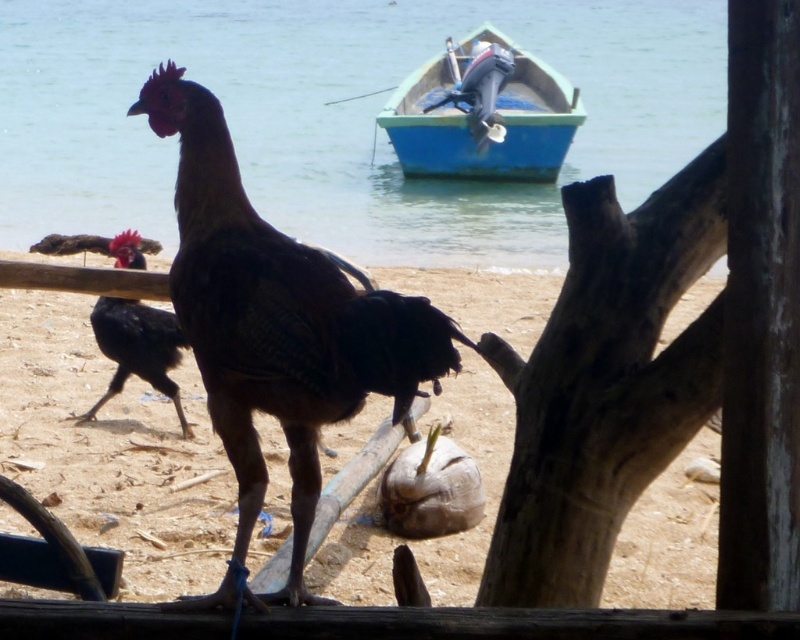
Which is below, blue painted wood boat at upper center or black matte chicken at center?

black matte chicken at center

Does blue painted wood boat at upper center appear on the left side of black matte chicken at center?

No, blue painted wood boat at upper center is not to the left of black matte chicken at center.

This screenshot has height=640, width=800. Identify the location of blue painted wood boat at upper center. (484, 113).

Identify the location of brown sandy beach at center. (112, 449).

Locate an element on the screen. brown sandy beach at center is located at coordinates (112, 449).

Which is more to the left, brown sandy beach at center or blue painted wood boat at upper center?

Positioned to the left is brown sandy beach at center.

Does brown sandy beach at center appear over blue painted wood boat at upper center?

Incorrect, brown sandy beach at center is not positioned above blue painted wood boat at upper center.

Is point (370, 596) positioned in front of point (520, 58)?

Yes.

This screenshot has height=640, width=800. What are the coordinates of `brown sandy beach at center` in the screenshot? It's located at (112, 449).